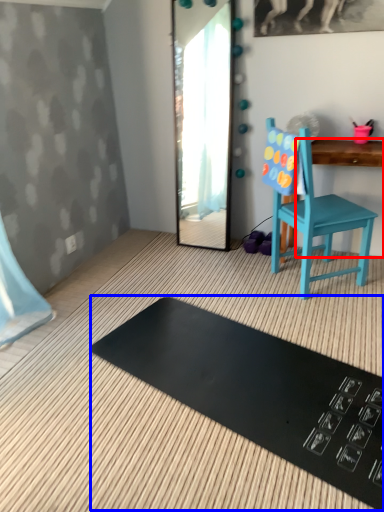
Question: Among these objects, which one is nearest to the camera, changing table (highlighted by a red box) or mat (highlighted by a blue box)?

Choices:
 (A) changing table
 (B) mat

Answer: (B)